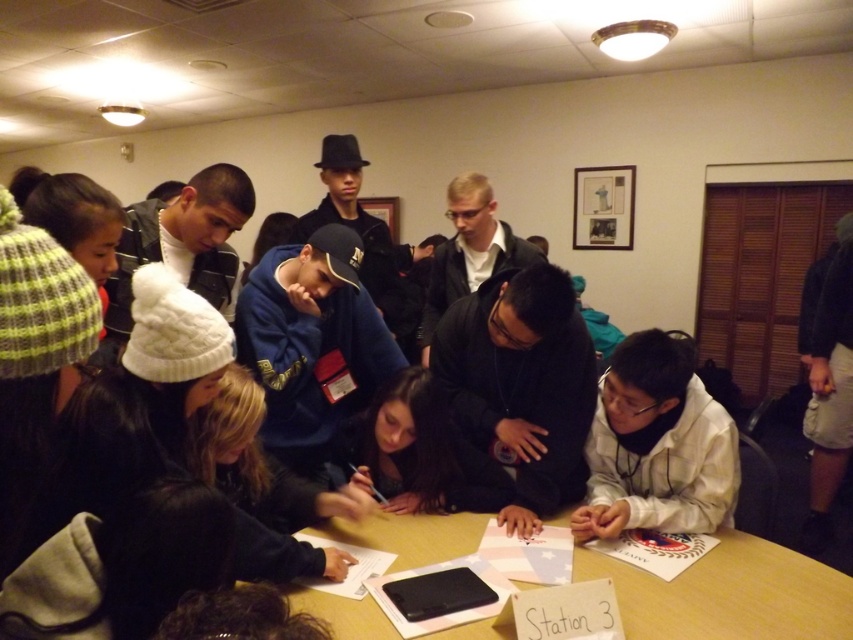
Image resolution: width=853 pixels, height=640 pixels. What do you see at coordinates (729, 593) in the screenshot?
I see `wooden table at center` at bounding box center [729, 593].

Which of these two, wooden table at center or white matte shirt at lower right, stands taller?

Standing taller between the two is white matte shirt at lower right.

Is point (804, 618) more distant than point (680, 355)?

That is False.

The image size is (853, 640). Identify the location of wooden table at center. (729, 593).